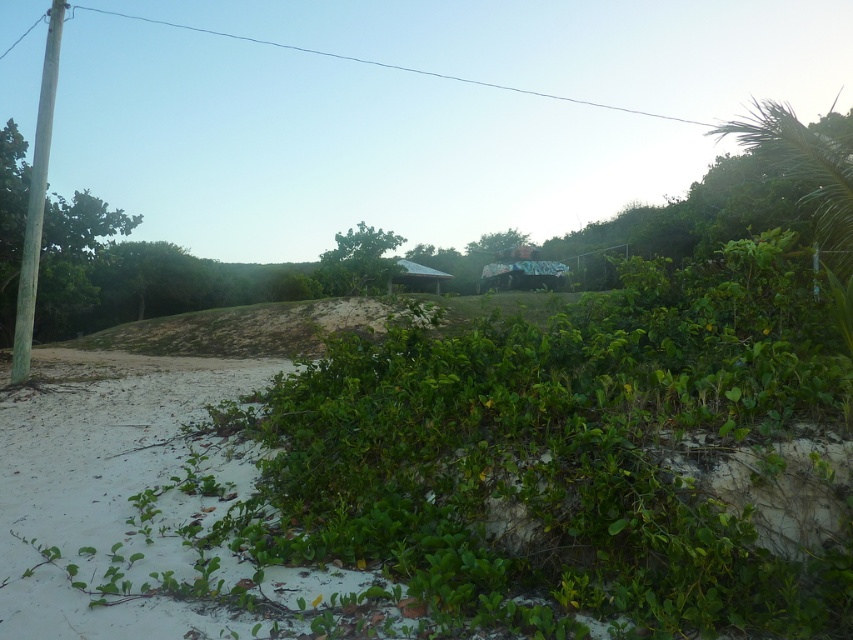
You are standing at the center of the sandy area in the image. Which direction should you walk to reach the smooth gray pole at left?

The smooth gray pole at left is located at point [36,198], which is to the left side of the frame. Since you are at the center of the sandy area, you should walk towards the left to reach the smooth gray pole at left.

You are a landscape architect planning to install a new pathway between the smooth gray pole at left and the green leafy bush at center. The pathway requires a minimum of 15 meters of space. Based on the scene, is the existing distance sufficient?

The distance between the smooth gray pole at left and the green leafy bush at center is 17.68 meters, which exceeds the required 15 meters. Therefore, the existing distance is sufficient for the pathway.